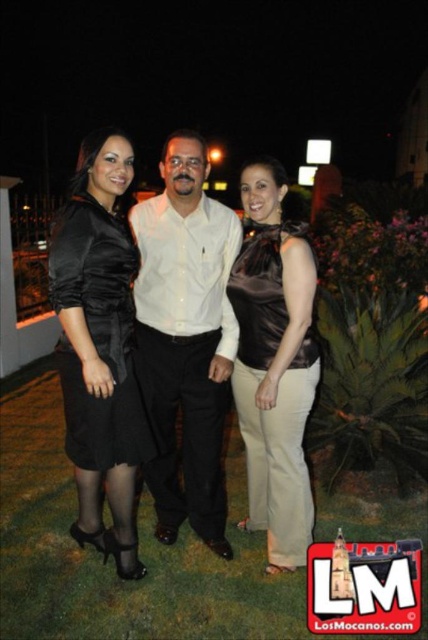
Is white smooth shirt at center in front of satin brown top at center?

Yes.

Which is more to the right, white smooth shirt at center or satin brown top at center?

satin brown top at center is more to the right.

This screenshot has height=640, width=428. What are the coordinates of `white smooth shirt at center` in the screenshot? It's located at (186, 339).

Locate an element on the screen. white smooth shirt at center is located at coordinates (186, 339).

Which is in front, point (193, 140) or point (282, 497)?

Positioned in front is point (282, 497).

Between satin black dress at center and satin brown top at center, which one is positioned higher?

satin black dress at center

Does point (240, 364) come farther from viewer compared to point (246, 184)?

Yes.

You are a GUI agent. You are given a task and a screenshot of the screen. Output one action in this format:
    pyautogui.click(x=<x>, y=<y>)
    Task: Click on the satin black dress at center
    The width and height of the screenshot is (428, 640).
    Given the screenshot: What is the action you would take?
    pyautogui.click(x=234, y=352)

How distant is satin black dress at center from white smooth shirt at center?

satin black dress at center is 4.37 inches from white smooth shirt at center.

Find the location of a particular element. The height and width of the screenshot is (640, 428). satin black dress at center is located at coordinates (234, 352).

This screenshot has width=428, height=640. In order to click on satin black dress at center in this screenshot , I will do `click(234, 352)`.